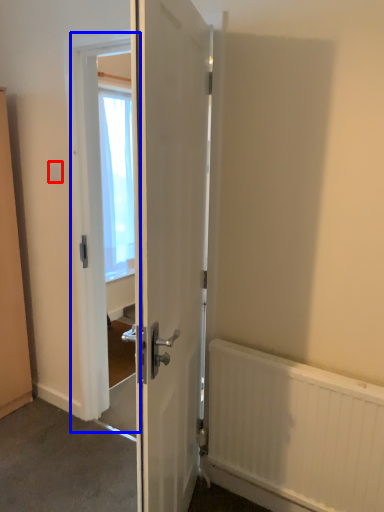
Question: Which of the following is the farthest to the observer, electric outlet (highlighted by a red box) or screen door (highlighted by a blue box)?

Choices:
 (A) electric outlet
 (B) screen door

Answer: (A)